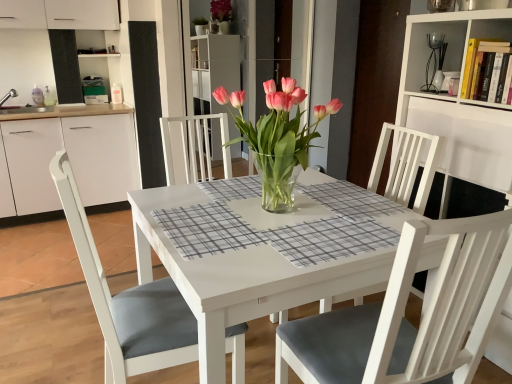
Question: From a real-world perspective, is white glossy table at center physically located above or below pink glass vase at center?

Choices:
 (A) above
 (B) below

Answer: (B)

Question: Considering their positions, is white glossy table at center located in front of or behind pink glass vase at center?

Choices:
 (A) behind
 (B) front

Answer: (B)

Question: Which of these objects is positioned farthest from the pink glass vase at center?

Choices:
 (A) white wood bookshelf at upper right
 (B) white glossy table at center
 (C) white wood chair at center
 (D) hardcover books at upper right

Answer: (D)

Question: Estimate the real-world distances between objects in this image. Which object is farther from the white wood chair at center?

Choices:
 (A) white glossy table at center
 (B) hardcover books at upper right
 (C) pink glass vase at center
 (D) white wood bookshelf at upper right

Answer: (B)